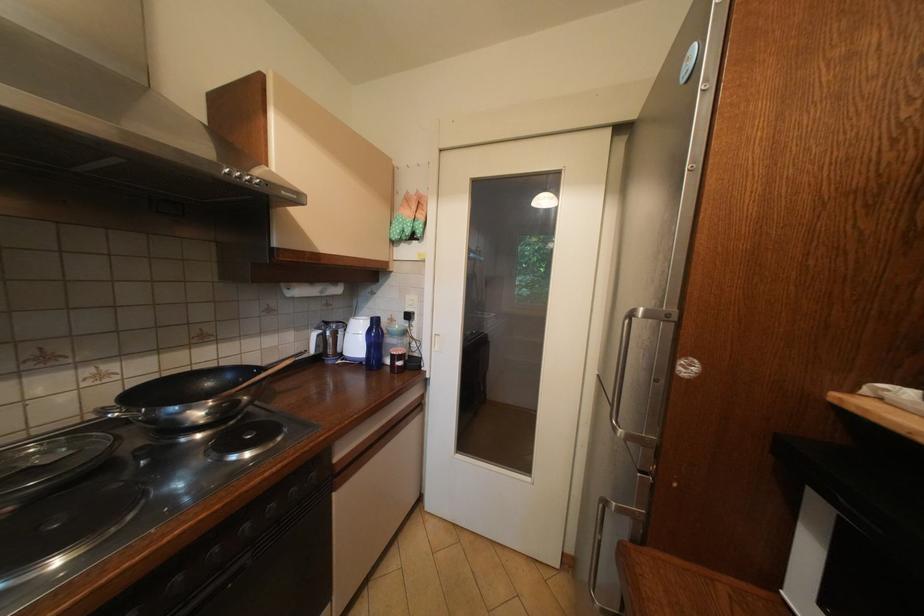
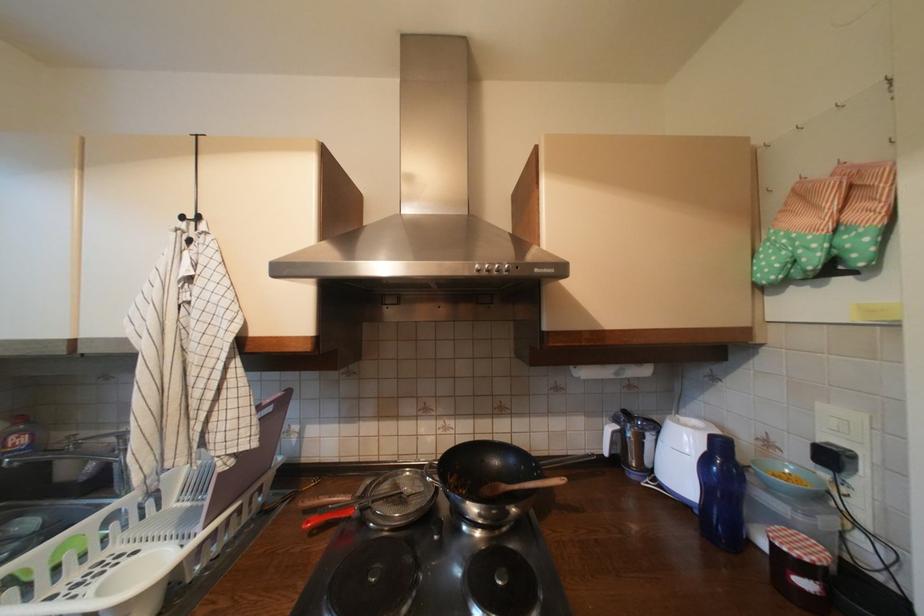
Find the pixel in the second image that matches [408,227] in the first image.

(793, 254)